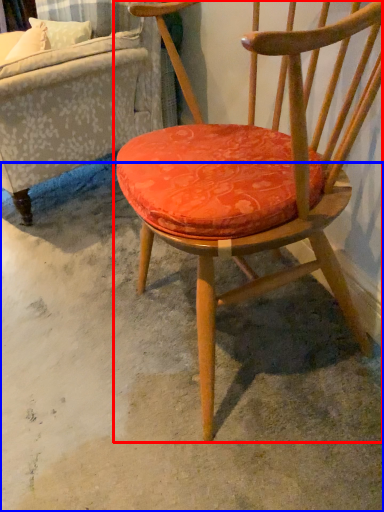
Question: Among these objects, which one is nearest to the camera, chair (highlighted by a red box) or concrete (highlighted by a blue box)?

Choices:
 (A) chair
 (B) concrete

Answer: (A)